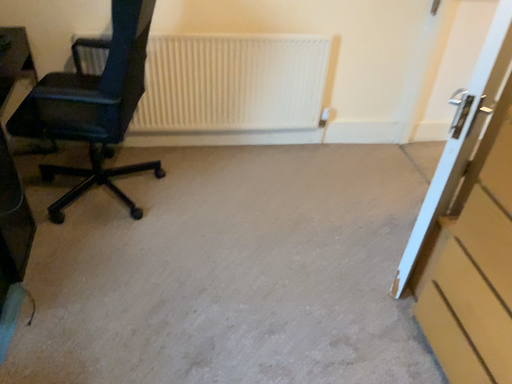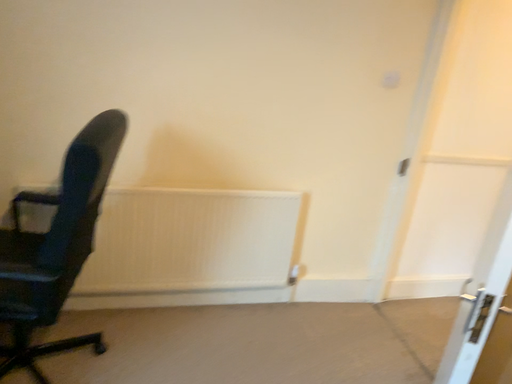
Question: Which way did the camera rotate in the video?

Choices:
 (A) rotated right
 (B) rotated left

Answer: (A)